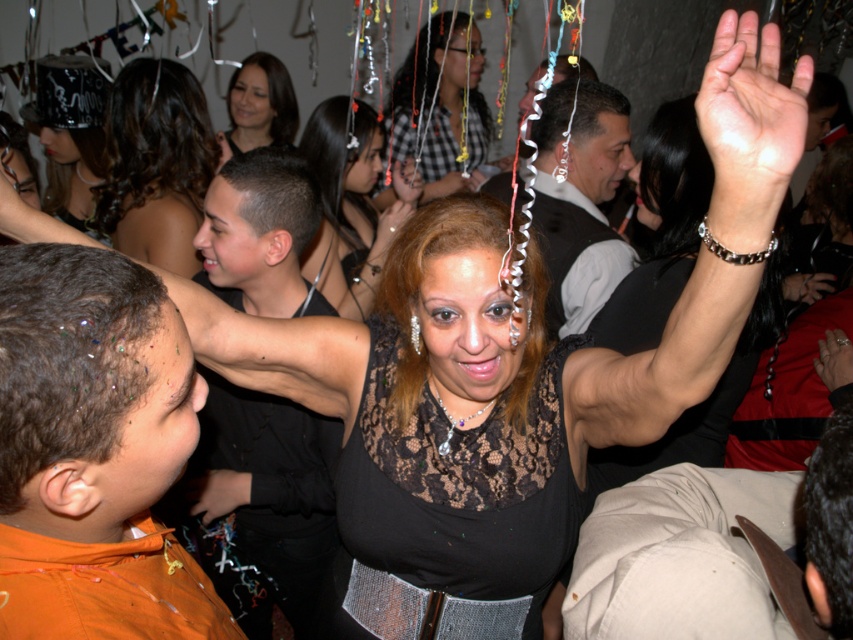
Question: Can you confirm if shiny black hair at center is positioned to the right of dark brown hair at upper center?

Choices:
 (A) no
 (B) yes

Answer: (A)

Question: Which point is closer to the camera taking this photo?

Choices:
 (A) (276, 292)
 (B) (143, 234)
 (C) (228, 86)

Answer: (A)

Question: Is orange fabric shirt at left to the right of black lace dress at center from the viewer's perspective?

Choices:
 (A) yes
 (B) no

Answer: (B)

Question: Which point is closer to the camera?

Choices:
 (A) (74, 298)
 (B) (457, 44)
 (C) (227, 99)
 (D) (561, 120)

Answer: (A)

Question: Does orange fabric shirt at left appear over shiny black hair at center?

Choices:
 (A) yes
 (B) no

Answer: (B)

Question: Which of the following is the farthest from the observer?

Choices:
 (A) shiny black shirt at center
 (B) checkered fabric shirt at center
 (C) black lace dress at center

Answer: (B)